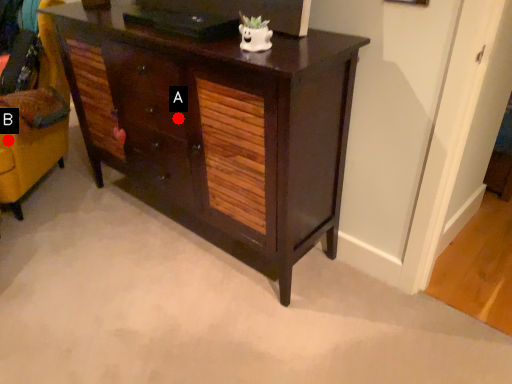
Question: Two points are circled on the image, labeled by A and B beside each circle. Which point is further to the camera?

Choices:
 (A) A is further
 (B) B is further

Answer: (B)